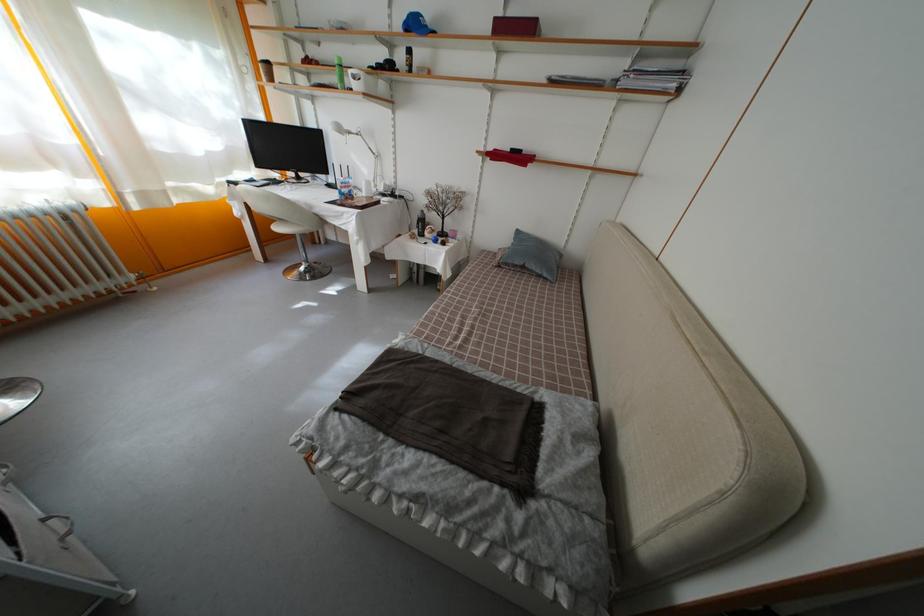
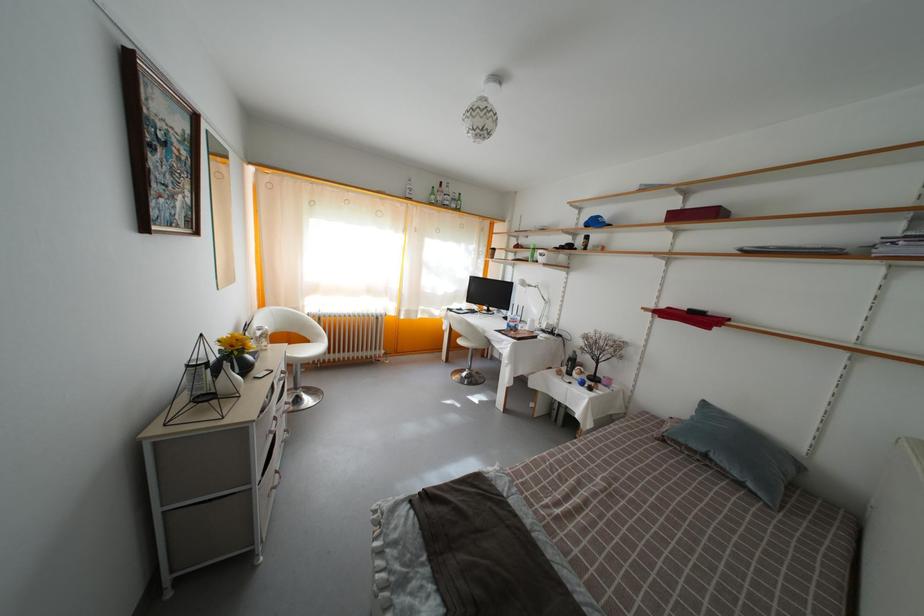
The point at (544,278) is marked in the first image. Where is the corresponding point in the second image?

(743, 482)